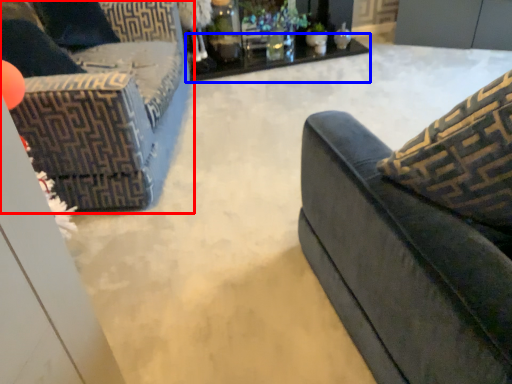
Question: Which point is further to the camera, studio couch (highlighted by a red box) or table (highlighted by a blue box)?

Choices:
 (A) studio couch
 (B) table

Answer: (B)